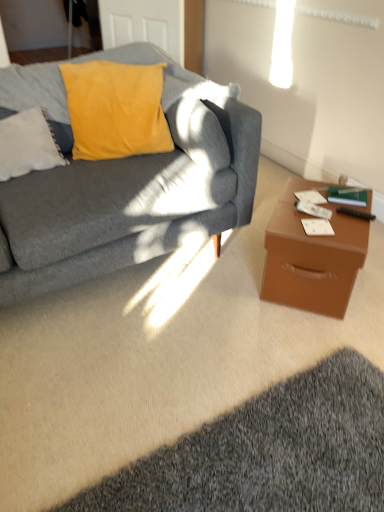
The height and width of the screenshot is (512, 384). I want to click on free space above brown leather desk at right (from a real-world perspective), so click(317, 211).